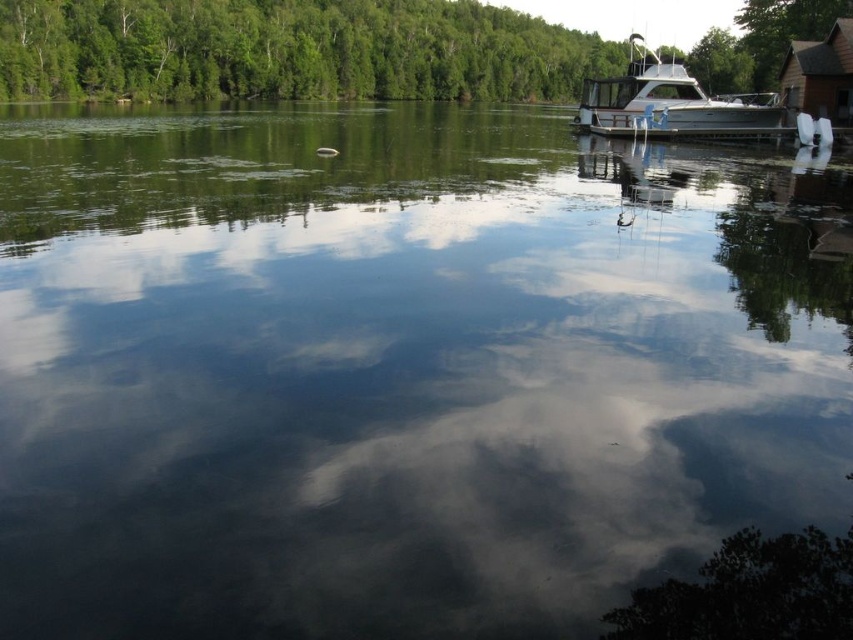
You are standing at the lakeside and want to take a photo of the silver metallic boat at upper right and the brown wooden cabin at upper right. Which object should you focus on first if you want to capture both in a single frame without moving your camera?

The silver metallic boat at upper right is much taller than the brown wooden cabin at upper right, so you should focus on the silver metallic boat at upper right first to ensure both are in frame.

You are an observer looking at the lakeside scene. You notice the green leafy tree at upper center and the silver metallic boat at upper right. Which object appears closer to you in the image?

The green leafy tree at upper center appears closer to you because the silver metallic boat at upper right is positioned behind it.